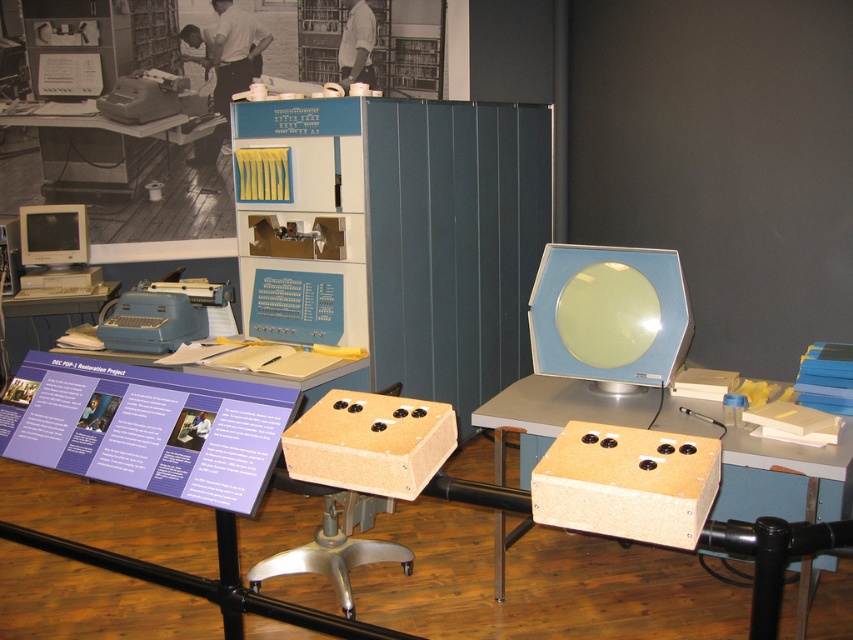
Question: Does matte blue typewriter at left come behind matte white monitor at left?

Choices:
 (A) yes
 (B) no

Answer: (B)

Question: Based on their relative distances, which object is nearer to the matte plastic table at lower left?

Choices:
 (A) matte white monitor at left
 (B) wooden box at center

Answer: (A)

Question: Does wooden at center appear on the right side of wooden box at center?

Choices:
 (A) yes
 (B) no

Answer: (A)

Question: Among these points, which one is nearest to the camera?

Choices:
 (A) (125, 179)
 (B) (32, 333)

Answer: (A)

Question: Does wooden table at center appear over wooden box at center?

Choices:
 (A) no
 (B) yes

Answer: (A)

Question: Which point appears farthest from the camera in this image?

Choices:
 (A) (572, 474)
 (B) (155, 342)

Answer: (B)